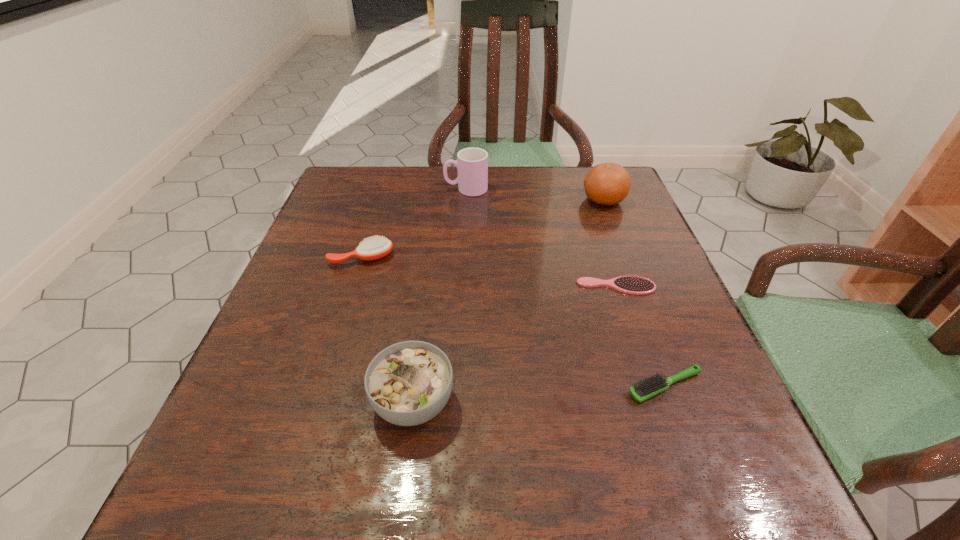
Identify which hairbrush is the nearest to the second farthest hairbrush. Please provide its 2D coordinates. Your answer should be formatted as a tuple, i.e. [(x, y)], where the tuple contains the x and y coordinates of a point satisfying the conditions above.

[(654, 385)]

Image resolution: width=960 pixels, height=540 pixels. In order to click on hairbrush identified as the closest to the shortest object in this screenshot , I will do `click(654, 385)`.

Where is `free spot that satisfies the following two spatial constraints: 1. on the front side of the shortest hairbrush; 2. on the left side of the fourth tallest object`? Image resolution: width=960 pixels, height=540 pixels. free spot that satisfies the following two spatial constraints: 1. on the front side of the shortest hairbrush; 2. on the left side of the fourth tallest object is located at coordinates (352, 286).